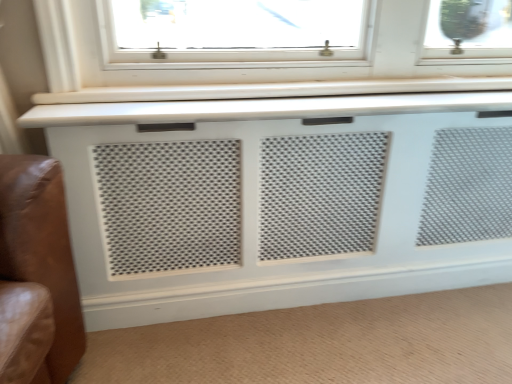
Find the location of a particular element. empty space that is ontop of white perforated grille at center (from a real-world perspective) is located at coordinates (314, 92).